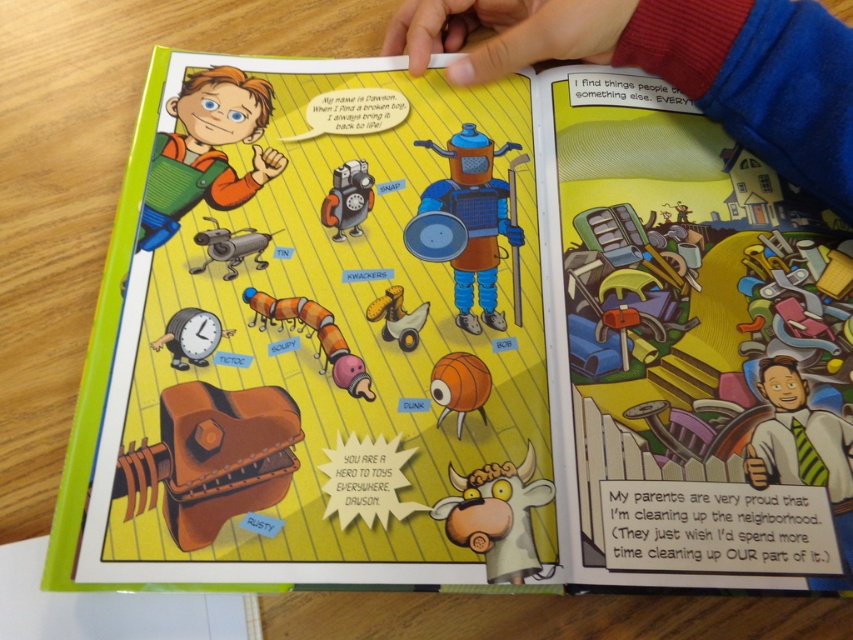
Consider the image. Can you confirm if orange fabric basketball at center is thinner than rusty metal clock at lower left?

Yes.

Is orange fabric basketball at center closer to camera compared to rusty metal clock at lower left?

Yes, orange fabric basketball at center is closer to the viewer.

The width and height of the screenshot is (853, 640). In order to click on orange fabric basketball at center in this screenshot , I will do `click(459, 385)`.

At what (x,y) coordinates should I click in order to perform the action: click on orange fabric basketball at center. Please return your answer as a coordinate pair (x, y). Looking at the image, I should click on (459, 385).

Is brown matte cow at lower center behind rubberized plastic caterpillar at center?

No.

Consider the image. Who is positioned more to the right, brown matte cow at lower center or rubberized plastic caterpillar at center?

From the viewer's perspective, brown matte cow at lower center appears more on the right side.

This screenshot has height=640, width=853. Describe the element at coordinates (496, 516) in the screenshot. I see `brown matte cow at lower center` at that location.

Locate an element on the screen. brown matte cow at lower center is located at coordinates (496, 516).

Between white striped tie at lower right and brown matte cow at lower center, which one is positioned higher?

white striped tie at lower right is above.

Does white striped tie at lower right lie in front of brown matte cow at lower center?

No.

Identify the location of white striped tie at lower right. (802, 451).